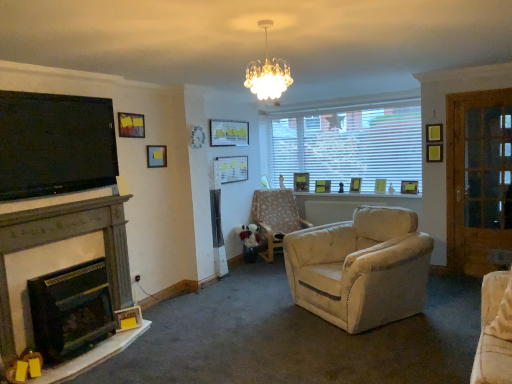
Question: Is floral fabric chair at center aimed at crystalline glass chandelier at upper center?

Choices:
 (A) yes
 (B) no

Answer: (A)

Question: From a real-world perspective, is floral fabric chair at center positioned under crystalline glass chandelier at upper center based on gravity?

Choices:
 (A) no
 (B) yes

Answer: (B)

Question: Is floral fabric chair at center positioned before crystalline glass chandelier at upper center?

Choices:
 (A) no
 (B) yes

Answer: (A)

Question: Does floral fabric chair at center have a smaller size compared to crystalline glass chandelier at upper center?

Choices:
 (A) no
 (B) yes

Answer: (A)

Question: Can you confirm if floral fabric chair at center is taller than crystalline glass chandelier at upper center?

Choices:
 (A) no
 (B) yes

Answer: (B)

Question: From the image's perspective, is matte wooden picture frame at center, the 1th picture frame in the back-to-front sequence, above or below matte black tv at left?

Choices:
 (A) below
 (B) above

Answer: (A)

Question: Relative to matte black tv at left, is matte wooden picture frame at center, the 1th picture frame in the back-to-front sequence, in front or behind?

Choices:
 (A) behind
 (B) front

Answer: (A)

Question: Is matte wooden picture frame at center, the 5th picture frame in the right-to-left sequence, to the left or to the right of matte black tv at left in the image?

Choices:
 (A) right
 (B) left

Answer: (A)

Question: Considering the positions of matte wooden picture frame at center, arranged as the ninth picture frame when viewed from the front, and matte black tv at left in the image, is matte wooden picture frame at center, arranged as the ninth picture frame when viewed from the front, wider or thinner than matte black tv at left?

Choices:
 (A) wide
 (B) thin

Answer: (A)

Question: Is matte yellow picture frame at window, which appears as the 4th picture frame when viewed from the right, spatially inside matte wooden picture frame at center, the 1th picture frame in the back-to-front sequence, or outside of it?

Choices:
 (A) outside
 (B) inside

Answer: (A)

Question: Considering the positions of matte yellow picture frame at window, which appears as the 4th picture frame when viewed from the right, and matte wooden picture frame at center, which is counted as the 5th picture frame, starting from the left, in the image, is matte yellow picture frame at window, which appears as the 4th picture frame when viewed from the right, bigger or smaller than matte wooden picture frame at center, which is counted as the 5th picture frame, starting from the left,?

Choices:
 (A) big
 (B) small

Answer: (B)

Question: Looking at their shapes, would you say matte yellow picture frame at window, which is counted as the 6th picture frame, starting from the left, is wider or thinner than matte wooden picture frame at center, the 5th picture frame in the right-to-left sequence?

Choices:
 (A) wide
 (B) thin

Answer: (B)

Question: From the image's perspective, is matte yellow picture frame at window, which appears as the 4th picture frame when viewed from the right, positioned above or below matte wooden picture frame at center, the 5th picture frame in the right-to-left sequence?

Choices:
 (A) below
 (B) above

Answer: (A)

Question: Does point (291, 223) appear closer or farther from the camera than point (287, 66)?

Choices:
 (A) closer
 (B) farther

Answer: (B)

Question: Considering their positions, is floral fabric chair at center located in front of or behind crystalline glass chandelier at upper center?

Choices:
 (A) front
 (B) behind

Answer: (B)